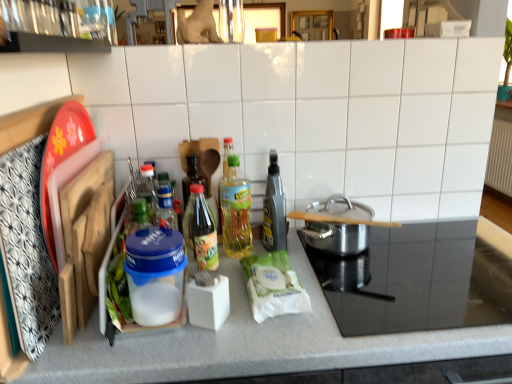
The height and width of the screenshot is (384, 512). What are the coordinates of `vacant space to the right of polished stainless steel pot at center right` in the screenshot? It's located at (420, 251).